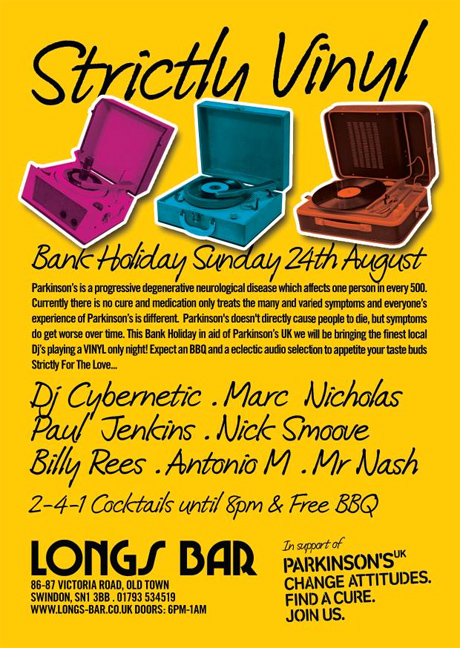
At what (x,y) coordinates should I click in order to perform the action: click on rectangular vintage advertisement. Please return your answer as a coordinate pair (x, y). The width and height of the screenshot is (460, 648). Looking at the image, I should click on click(9, 13).